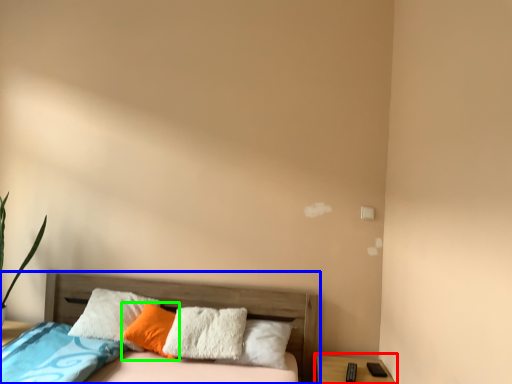
Question: Based on their relative distances, which object is farther from nightstand (highlighted by a red box)? Choose from bed (highlighted by a blue box) and pillow (highlighted by a green box).

Choices:
 (A) bed
 (B) pillow

Answer: (B)